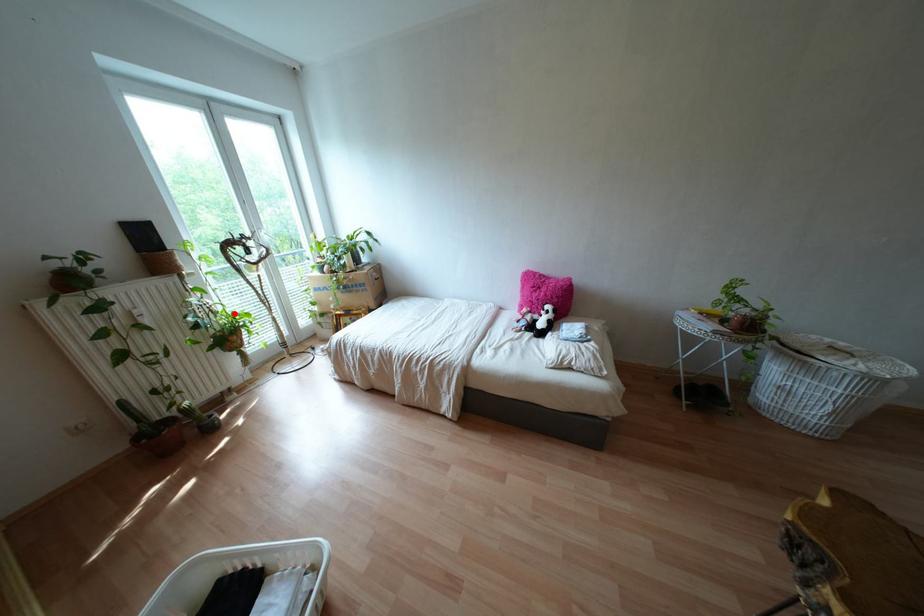
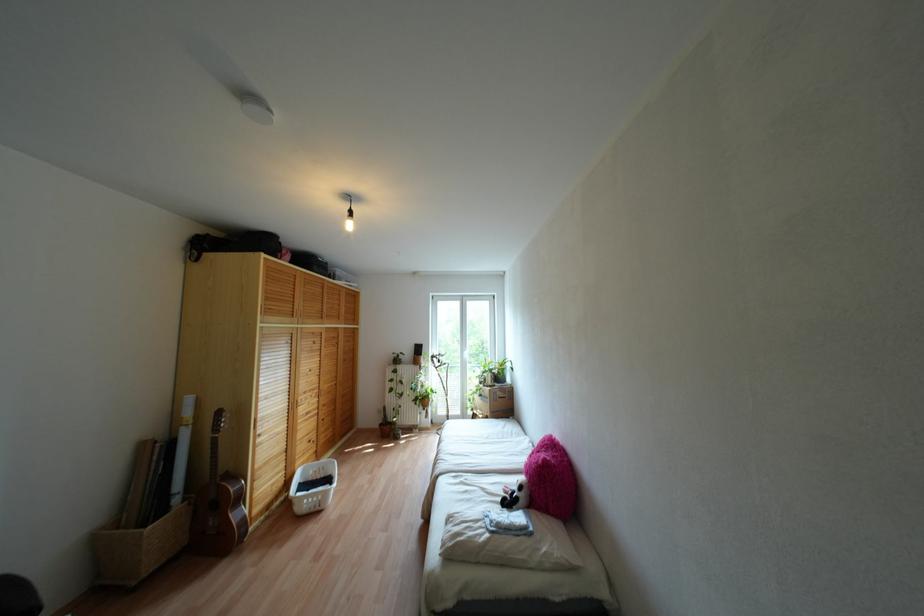
Question: I am providing you with two images of the same scene from different viewpoints. Image1 has a red point marked. In image2, the corresponding 3D location appears at what relative position? Reply with the corresponding letter.

Choices:
 (A) Closer
 (B) Farther

Answer: (B)